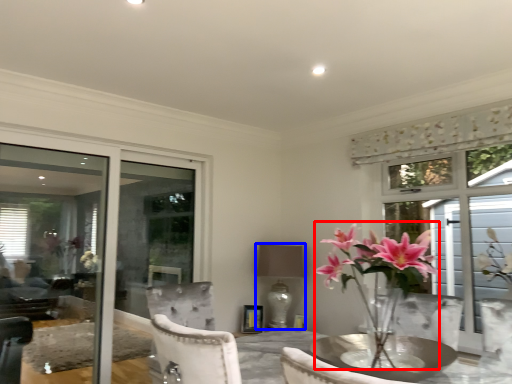
Question: Which object appears closest to the camera in this image, floral arrangement (highlighted by a red box) or lamp (highlighted by a blue box)?

Choices:
 (A) floral arrangement
 (B) lamp

Answer: (A)